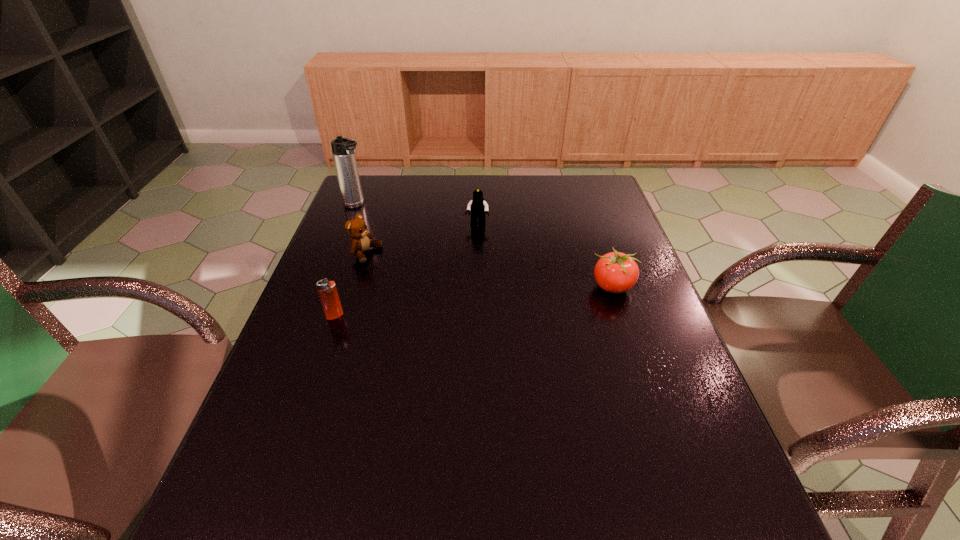
Find the location of a particular element. Image resolution: width=960 pixels, height=540 pixels. free space at the near right corner is located at coordinates (681, 460).

In order to click on free spot between the thermos bottle and the nearest object in this screenshot , I will do `click(346, 261)`.

Where is `empty space between the third farthest object and the nearest object`? empty space between the third farthest object and the nearest object is located at coordinates (350, 285).

Where is `vacant area that lies between the rightmost object and the igniter`? The width and height of the screenshot is (960, 540). vacant area that lies between the rightmost object and the igniter is located at coordinates (473, 301).

Locate an element on the screen. vacant point located between the Lego and the third nearest object is located at coordinates (421, 239).

At what (x,y) coordinates should I click in order to perform the action: click on empty space that is in between the nearest object and the third nearest object. Please return your answer as a coordinate pair (x, y). Image resolution: width=960 pixels, height=540 pixels. Looking at the image, I should click on (350, 285).

Find the location of a particular element. The height and width of the screenshot is (540, 960). empty space that is in between the third farthest object and the second farthest object is located at coordinates (421, 239).

Locate an element on the screen. vacant area that lies between the Lego and the tomato is located at coordinates (544, 255).

The image size is (960, 540). In order to click on vacant space that's between the rightmost object and the third farthest object in this screenshot , I will do `click(489, 270)`.

Where is `vacant space that's between the fourth nearest object and the rightmost object`? This screenshot has height=540, width=960. vacant space that's between the fourth nearest object and the rightmost object is located at coordinates (544, 255).